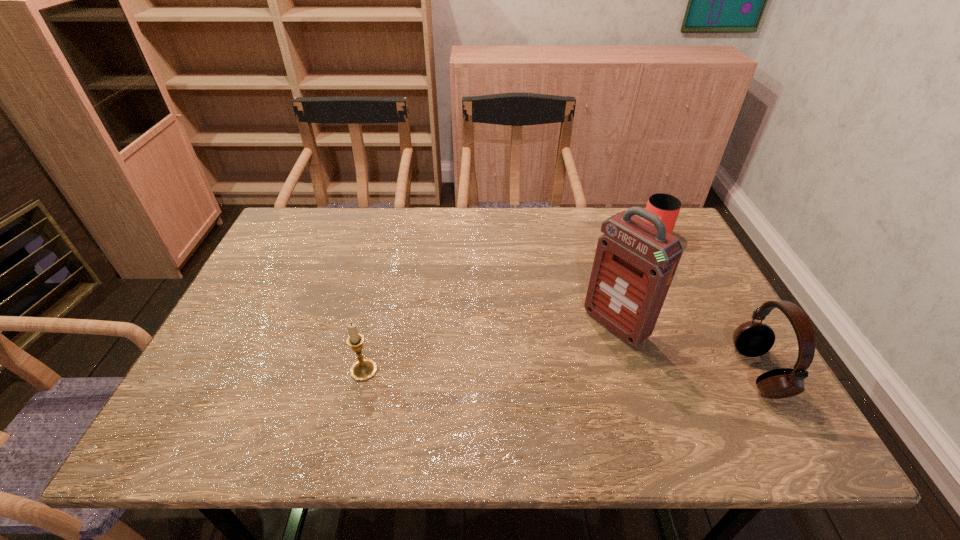
This screenshot has height=540, width=960. I want to click on the leftmost object, so click(x=364, y=369).

Locate an element on the screen. The height and width of the screenshot is (540, 960). candle holder is located at coordinates (364, 369).

Locate an element on the screen. The image size is (960, 540). the third shortest object is located at coordinates 752,339.

Identify the location of cup. The height and width of the screenshot is (540, 960). (667, 207).

The height and width of the screenshot is (540, 960). I want to click on the farthest object, so click(667, 207).

Where is `the tallest object`? the tallest object is located at coordinates (635, 262).

Find the location of a particular element. This screenshot has width=960, height=540. the first-aid kit is located at coordinates (635, 262).

Where is `vacant space located on the right of the candle holder`? vacant space located on the right of the candle holder is located at coordinates (475, 370).

Identify the location of free region located 0.310m on the ear pads of the headset. This screenshot has width=960, height=540. (601, 372).

The width and height of the screenshot is (960, 540). In order to click on blank space located 0.140m on the ear pads of the headset in this screenshot , I will do `click(677, 372)`.